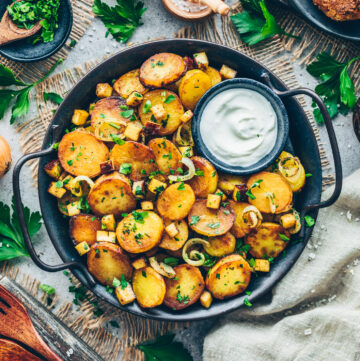
Locate an element on the screen. This screenshot has width=360, height=361. handles is located at coordinates (28, 238), (334, 190).